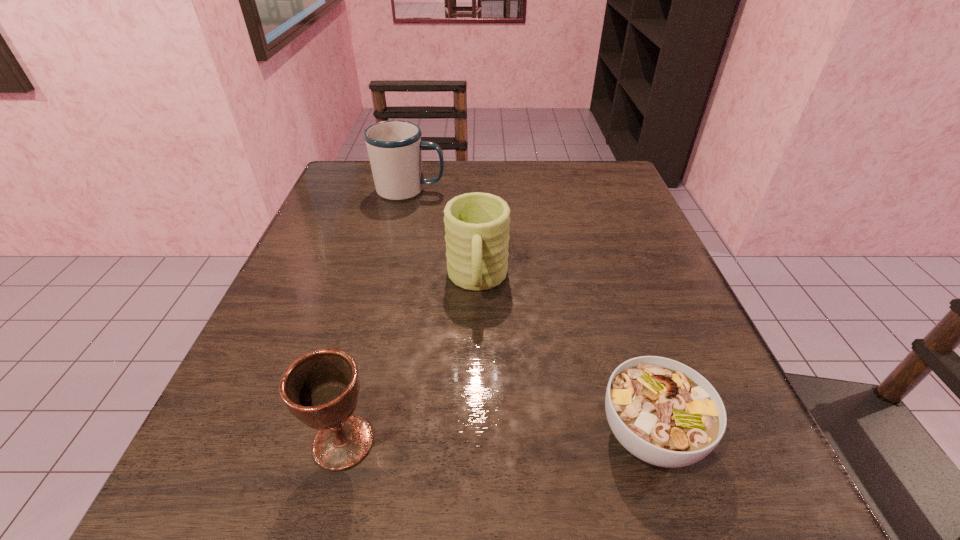
You are a GUI agent. You are given a task and a screenshot of the screen. Output one action in this format:
    pyautogui.click(x=<x>, y=<y>)
    Task: Click on the free spot between the left mug and the third nearest object
    Image resolution: width=960 pixels, height=540 pixels.
    Given the screenshot: What is the action you would take?
    pyautogui.click(x=444, y=235)

The width and height of the screenshot is (960, 540). In order to click on free space between the chalice and the rightmost object in this screenshot , I will do `click(496, 438)`.

The width and height of the screenshot is (960, 540). I want to click on vacant space that is in between the nearer mug and the left mug, so click(444, 235).

At what (x,y) coordinates should I click in order to perform the action: click on vacant space that is in between the farthest object and the shortest object. Please return your answer as a coordinate pair (x, y). The image size is (960, 540). Looking at the image, I should click on (530, 312).

Identify the location of free space between the third nearest object and the chalice. Image resolution: width=960 pixels, height=540 pixels. 410,361.

At what (x,y) coordinates should I click in order to perform the action: click on free space between the chalice and the soup bowl. Please return your answer as a coordinate pair (x, y). Looking at the image, I should click on (496, 438).

Identify the location of vacant space that's between the chalice and the rightmost object. This screenshot has width=960, height=540. (496, 438).

You are a GUI agent. You are given a task and a screenshot of the screen. Output one action in this format:
    pyautogui.click(x=<x>, y=<y>)
    Task: Click on the free space between the farthest object and the third nearest object
    The width and height of the screenshot is (960, 540).
    Given the screenshot: What is the action you would take?
    coord(444,235)

Identify which object is located as the second nearest to the third object from left to right. Please provide its 2D coordinates. Your answer should be formatted as a tuple, i.e. [(x, y)], where the tuple contains the x and y coordinates of a point satisfying the conditions above.

[(394, 147)]

Locate an element on the screen. This screenshot has height=540, width=960. the closest object to the nearer mug is located at coordinates (663, 412).